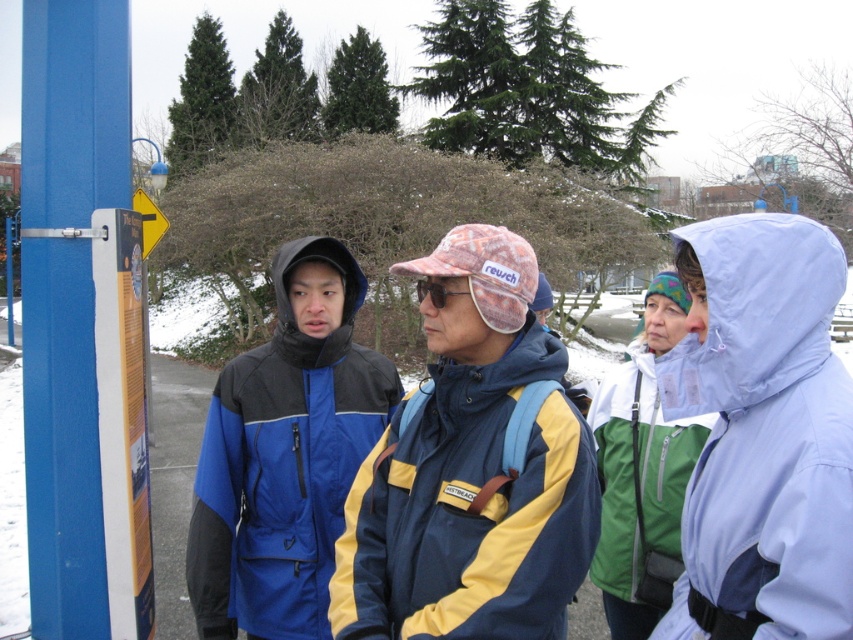
You are a photographer trying to capture both the green matte jacket at center and the pink fabric goggles at center in a single frame. Given their widths, which object should you adjust your camera angle to focus on to ensure both are fully visible?

The green matte jacket at center is wider than the pink fabric goggles at center, so you should focus on the green matte jacket at center to ensure both objects are fully visible in the frame.

You are standing in a winter scene with a group of people. You see a green matte jacket at center. Can you reach out and touch it without moving your feet?

The green matte jacket at center and viewer are 5.48 feet apart, so no, you cannot reach it without moving your feet since the distance is greater than an average person arm length.